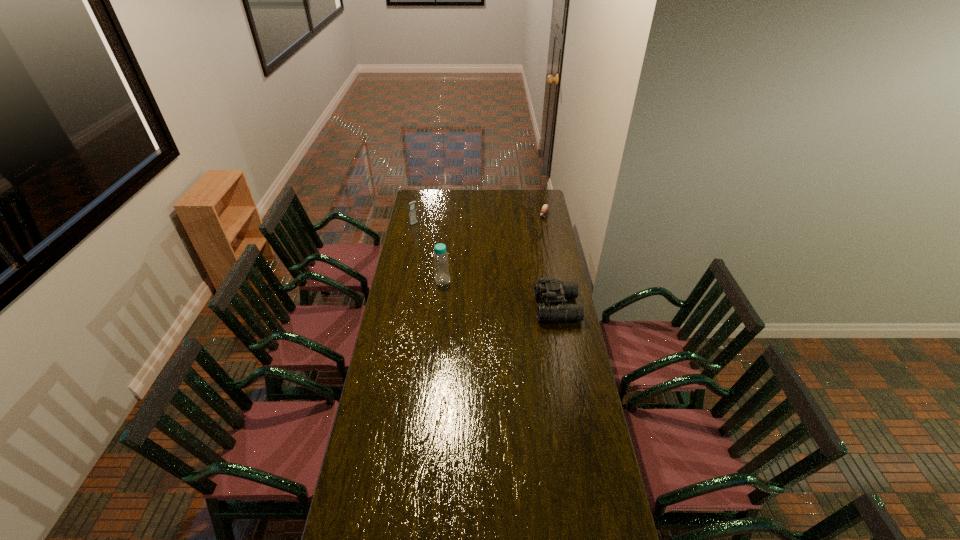
At what (x,y) coordinates should I click in order to perform the action: click on free space at the far edge. Please return your answer as a coordinate pair (x, y). Looking at the image, I should click on (443, 191).

This screenshot has height=540, width=960. I want to click on vacant space at the near edge, so click(x=537, y=529).

Image resolution: width=960 pixels, height=540 pixels. I want to click on vacant area at the left edge, so click(396, 477).

Where is `free space at the right edge of the desktop`? The width and height of the screenshot is (960, 540). free space at the right edge of the desktop is located at coordinates (559, 421).

You are a GUI agent. You are given a task and a screenshot of the screen. Output one action in this format:
    pyautogui.click(x=<x>, y=<y>)
    Task: Click on the vacant space at the far left corner of the desktop
    This screenshot has height=540, width=960.
    Given the screenshot: What is the action you would take?
    pyautogui.click(x=437, y=194)

In order to click on vacant space in between the binoculars and the farthest object in this screenshot , I will do `click(550, 261)`.

Find the location of a particular element. empty space between the binoculars and the escargot is located at coordinates (550, 261).

Identify the location of vacant space in between the escargot and the cellular telephone. Image resolution: width=960 pixels, height=540 pixels. (479, 220).

Locate an element on the screen. free space that is in between the farthest object and the binoculars is located at coordinates (550, 261).

Identify the location of free space between the farthest object and the binoculars. This screenshot has height=540, width=960. (550, 261).